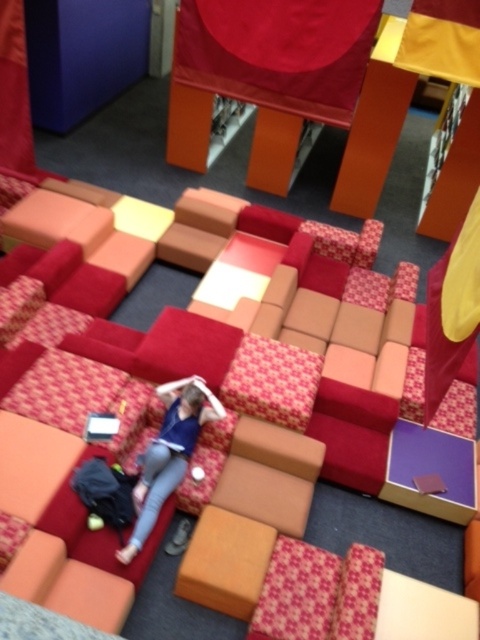
Does point (76, 296) come closer to viewer compared to point (123, 561)?

No, (76, 296) is behind (123, 561).

Can you confirm if textured fabric couch at center is bigger than matte blue shirt at center?

No.

This screenshot has height=640, width=480. I want to click on textured fabric couch at center, so click(x=351, y=435).

At what (x,y) coordinates should I click in order to perform the action: click on textured fabric couch at center. Please return your answer as a coordinate pair (x, y). The width and height of the screenshot is (480, 640). Looking at the image, I should click on (351, 435).